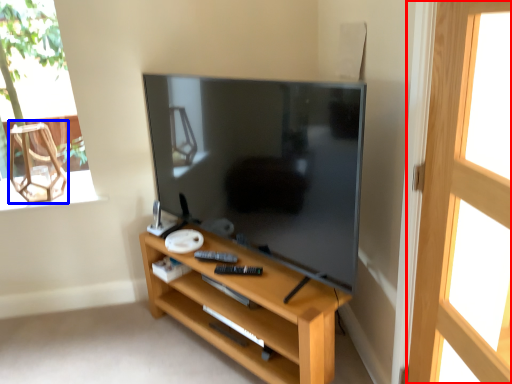
Question: Which object is closer to the camera taking this photo, screen door (highlighted by a red box) or armchair (highlighted by a blue box)?

Choices:
 (A) screen door
 (B) armchair

Answer: (A)